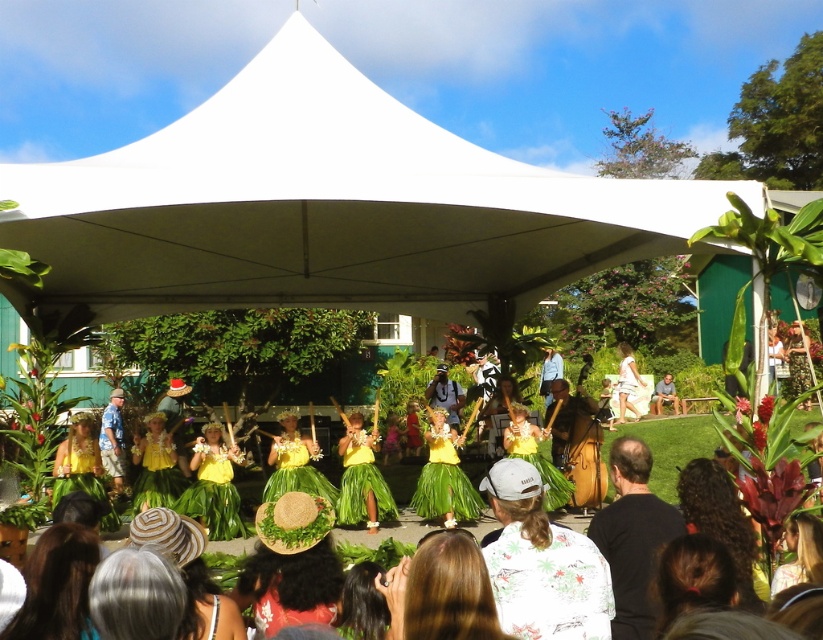
Question: Does white fabric canopy at center appear under light brown wooden bench at center?

Choices:
 (A) yes
 (B) no

Answer: (B)

Question: Which point is farther to the camera?

Choices:
 (A) (621, 358)
 (B) (31, 163)
 (C) (652, 394)

Answer: (B)

Question: Estimate the real-world distances between objects in this image. Which object is closer to the light brown wooden bench at center?

Choices:
 (A) white fabric canopy at center
 (B) white cotton dress at center
 (C) light blue denim shirt at center

Answer: (B)

Question: Which point appears closest to the camera in this image?

Choices:
 (A) (179, 164)
 (B) (103, 410)
 (C) (628, 381)

Answer: (A)

Question: Does white fabric canopy at center appear under light brown wooden bench at center?

Choices:
 (A) yes
 (B) no

Answer: (B)

Question: Is light blue denim shirt at center behind light brown wooden bench at center?

Choices:
 (A) yes
 (B) no

Answer: (B)